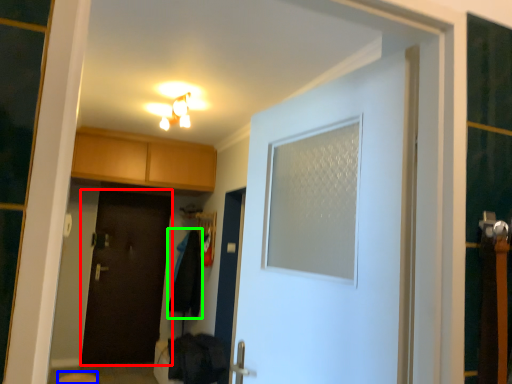
Question: Which object is positioned farthest from door (highlighted by a red box)? Select from step stool (highlighted by a blue box) and laundry (highlighted by a green box).

Choices:
 (A) step stool
 (B) laundry

Answer: (A)